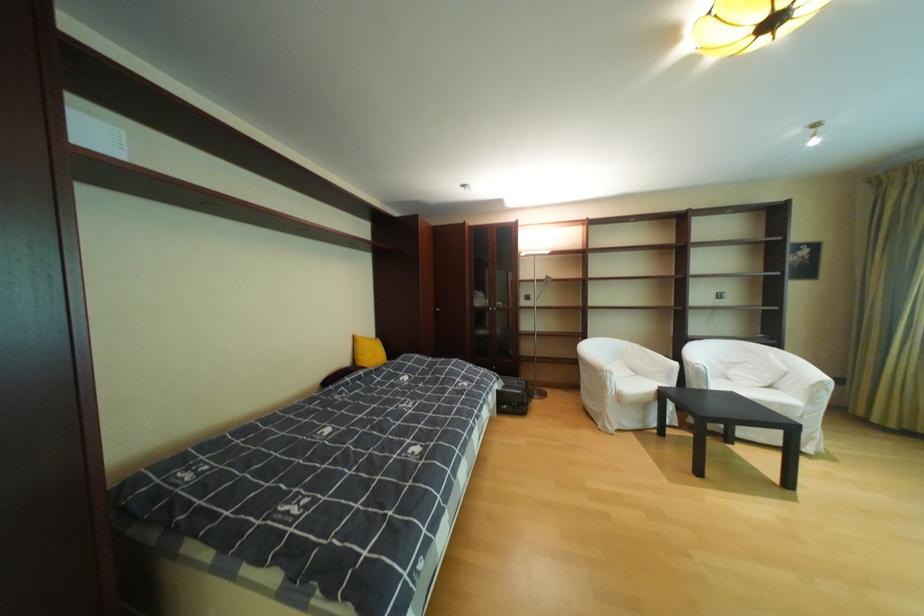
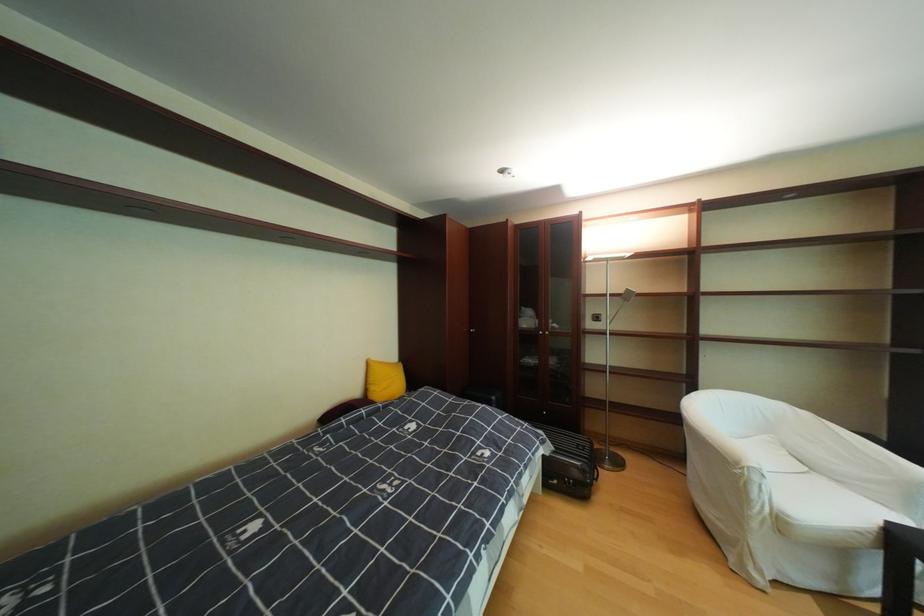
In a continuous first-person perspective shot, in which direction is the camera moving?

The cameraman moved toward right, forward.